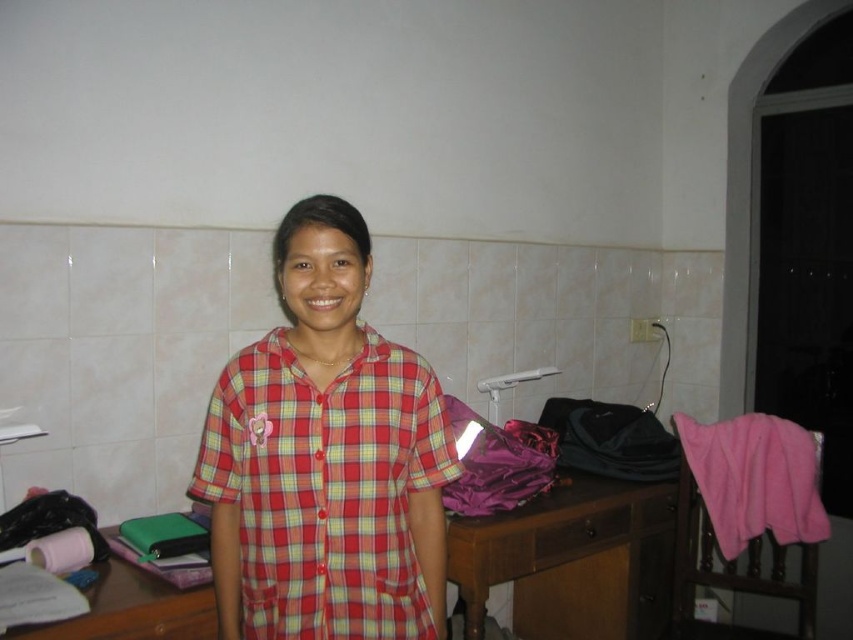
Question: Can you confirm if pink fleece blanket at right is positioned below pink leather wallet at lower left?

Choices:
 (A) yes
 (B) no

Answer: (B)

Question: Is red plaid shirt at center positioned behind pink fleece blanket at right?

Choices:
 (A) yes
 (B) no

Answer: (B)

Question: Which point is closer to the camera?

Choices:
 (A) (595, 557)
 (B) (627, 515)
 (C) (173, 618)
 (D) (265, 500)

Answer: (D)

Question: In this image, where is pink fleece blanket at right located relative to pink leather wallet at lower left?

Choices:
 (A) below
 (B) above

Answer: (B)

Question: Estimate the real-world distances between objects in this image. Which object is farther from the pink fleece blanket at right?

Choices:
 (A) wooden drawer at center
 (B) brown wooden table at lower right
 (C) red plaid shirt at center

Answer: (C)

Question: Which object is farther from the camera taking this photo?

Choices:
 (A) pink fleece blanket at right
 (B) brown wooden table at lower right

Answer: (A)